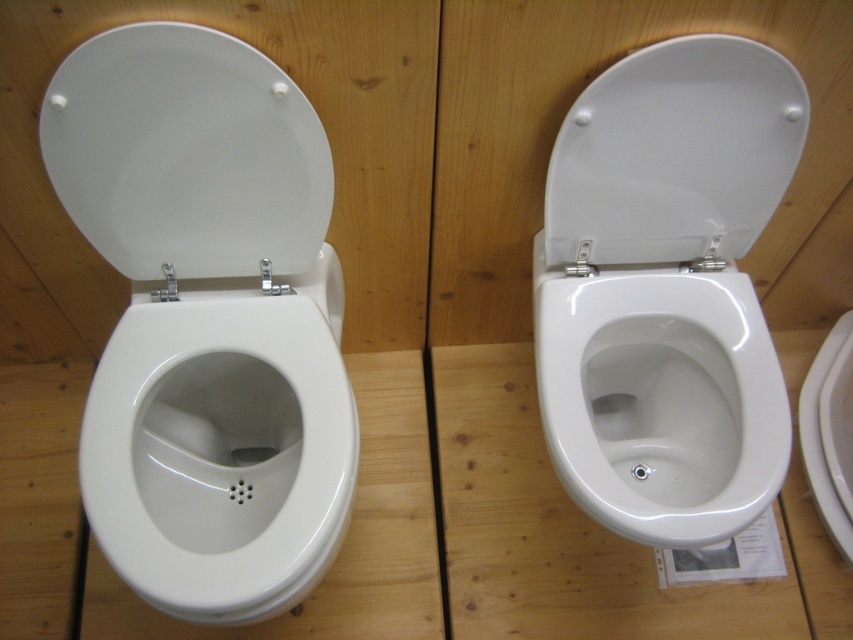
Question: Can you confirm if white glossy toilet bowl at left is positioned below white glossy toilet seat at upper right?

Choices:
 (A) yes
 (B) no

Answer: (A)

Question: Which of the following is the closest to the observer?

Choices:
 (A) glossy ceramic toilet at upper left
 (B) white glossy toilet bowl at left
 (C) white glossy toilet lid at left
 (D) white glossy toilet seat at upper right

Answer: (A)

Question: Does glossy ceramic toilet at upper left appear on the right side of white glossy toilet seat at upper right?

Choices:
 (A) no
 (B) yes

Answer: (A)

Question: Does glossy ceramic toilet at upper left come behind white glossy toilet lid at left?

Choices:
 (A) no
 (B) yes

Answer: (A)

Question: Among these points, which one is farthest from the camera?

Choices:
 (A) (712, 193)
 (B) (636, 60)

Answer: (A)

Question: Based on their relative distances, which object is farther from the white glossy toilet seat at upper right?

Choices:
 (A) white glossy toilet at upper center
 (B) white glossy toilet bowl at left

Answer: (B)